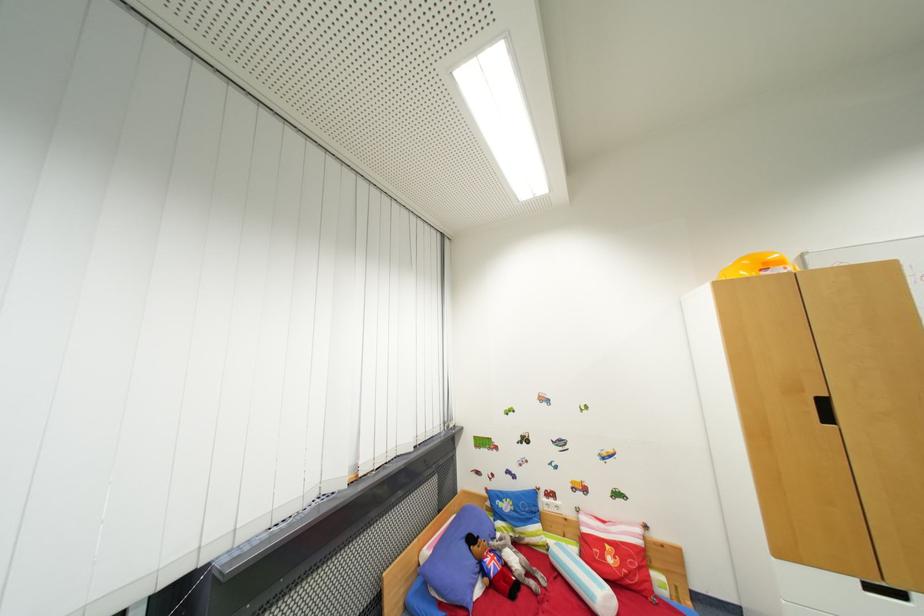
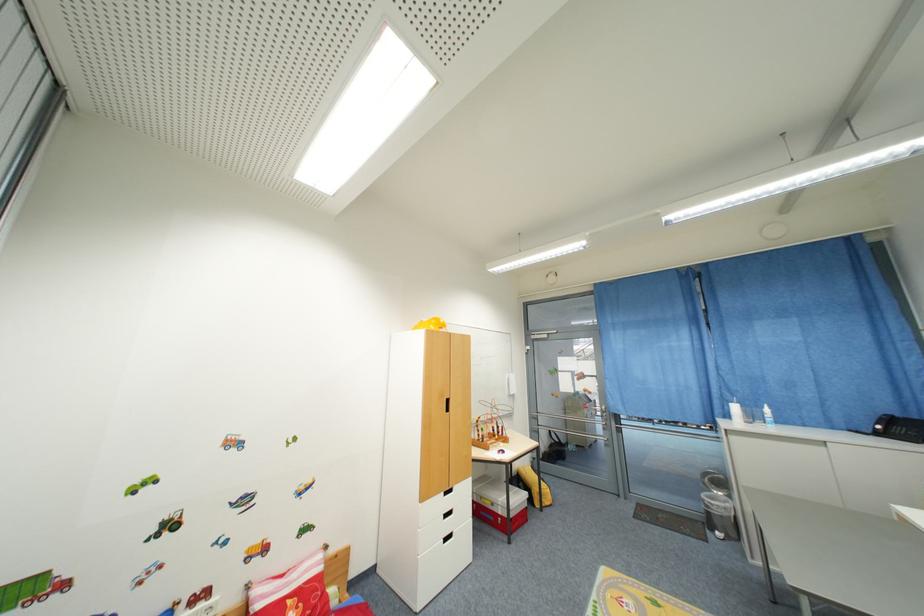
Question: How did the camera likely rotate?

Choices:
 (A) Left
 (B) Right
 (C) Up
 (D) Down

Answer: (B)